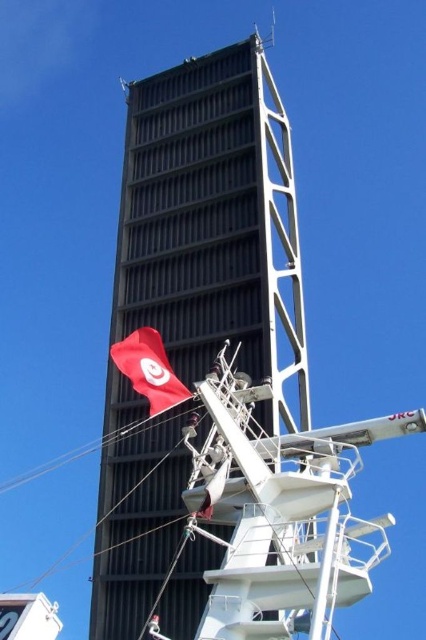
Question: Is black textured panel at center further to the viewer compared to red fabric flag at left?

Choices:
 (A) no
 (B) yes

Answer: (B)

Question: Is black textured panel at center wider than red fabric flag at left?

Choices:
 (A) yes
 (B) no

Answer: (A)

Question: Which of the following is the farthest from the observer?

Choices:
 (A) (180, 81)
 (B) (131, 372)

Answer: (A)

Question: Considering the relative positions of black textured panel at center and red fabric flag at left in the image provided, where is black textured panel at center located with respect to red fabric flag at left?

Choices:
 (A) right
 (B) left

Answer: (A)